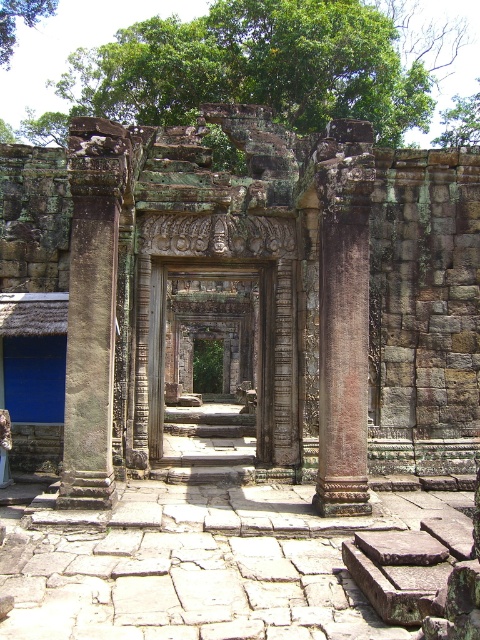
Question: Is green leafy tree at upper center wider than green leafy tree at upper left?

Choices:
 (A) no
 (B) yes

Answer: (B)

Question: Is rustic stone column at center positioned behind green leafy tree at upper center?

Choices:
 (A) yes
 (B) no

Answer: (B)

Question: Which of these objects is positioned closest to the gray stone column at left?

Choices:
 (A) green leafy tree at upper center
 (B) gray stone archway at center
 (C) green leafy tree at upper left
 (D) rustic stone column at center

Answer: (D)

Question: In this image, where is weathered stone doorway at center located relative to green leafy tree at upper left?

Choices:
 (A) below
 (B) above

Answer: (A)

Question: Which point is farther from the camera taking this photo?

Choices:
 (A) (264, 381)
 (B) (351, 364)

Answer: (A)

Question: Considering the real-world distances, which object is farthest from the gray stone archway at center?

Choices:
 (A) rustic stone column at center
 (B) green leafy tree at upper center
 (C) weathered stone doorway at center

Answer: (B)